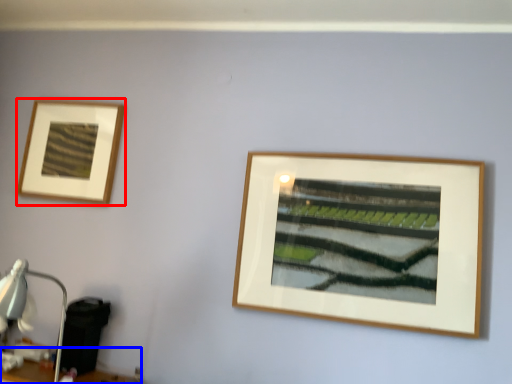
Question: Which of the following is the farthest to the observer, picture frame (highlighted by a red box) or table (highlighted by a blue box)?

Choices:
 (A) picture frame
 (B) table

Answer: (A)